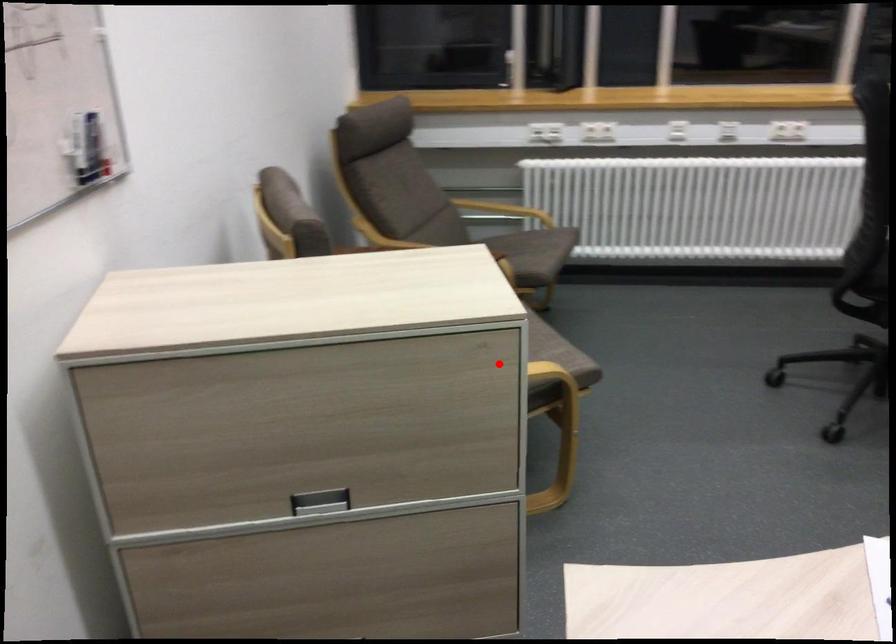
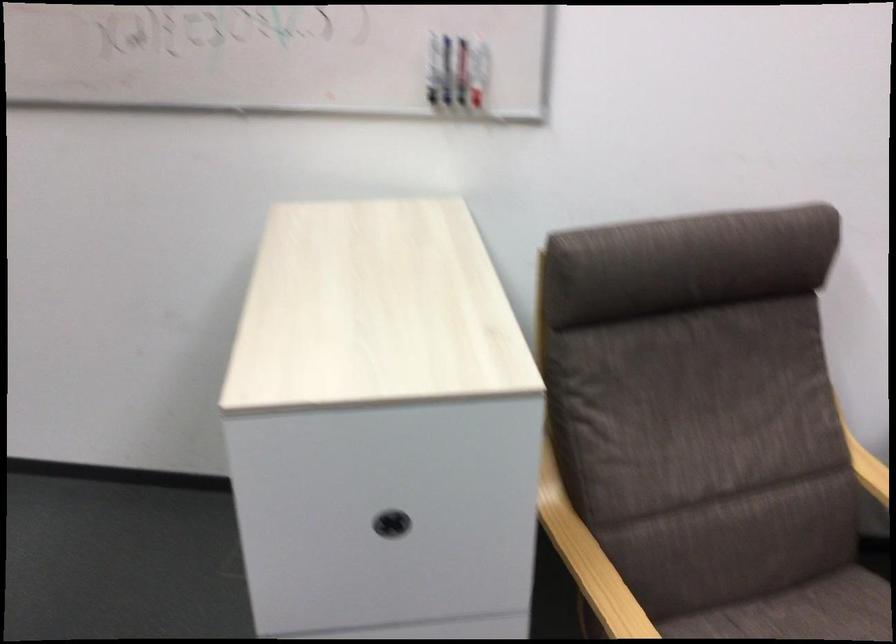
Question: I am providing you with two images of the same scene from different viewpoints. Given a red point in image1, look at the same physical point in image2. Is it:

Choices:
 (A) Closer to the viewpoint
 (B) Farther from the viewpoint

Answer: (A)